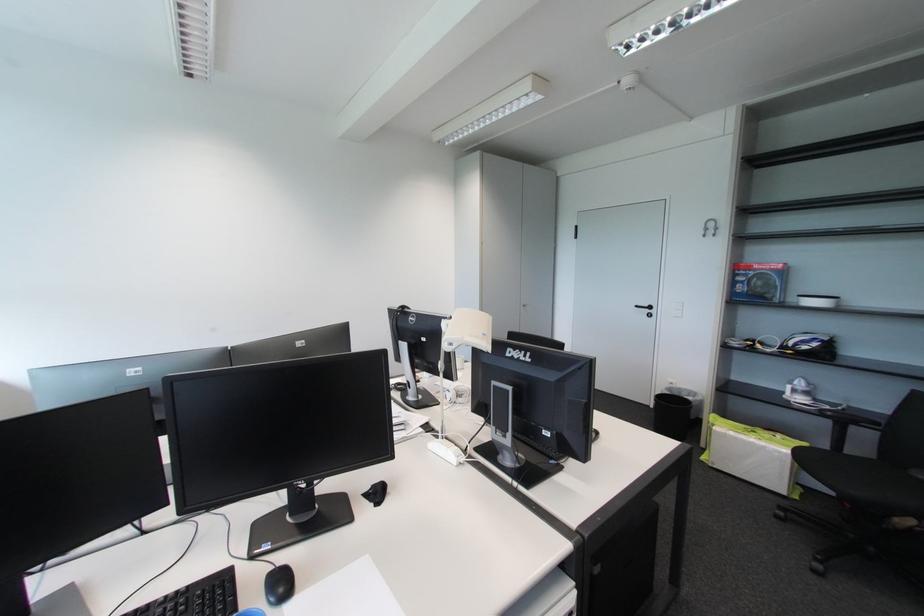
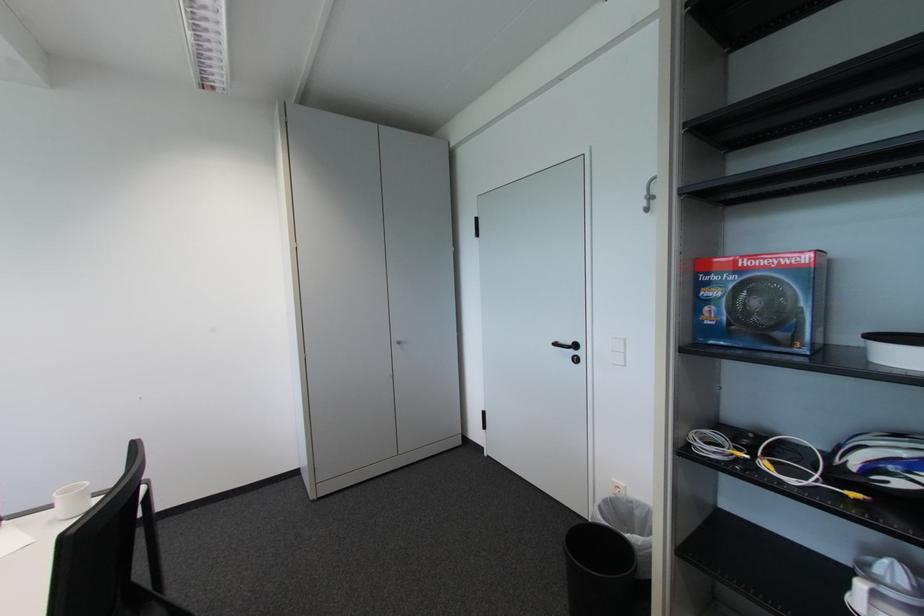
In a continuous first-person perspective shot, in which direction is the camera moving?

The cameraman moved toward right, forward.